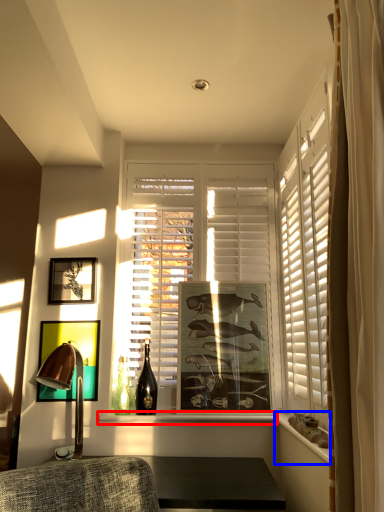
Question: Which object appears closest to the camera in this image, window sill (highlighted by a red box) or ledge (highlighted by a blue box)?

Choices:
 (A) window sill
 (B) ledge

Answer: (B)